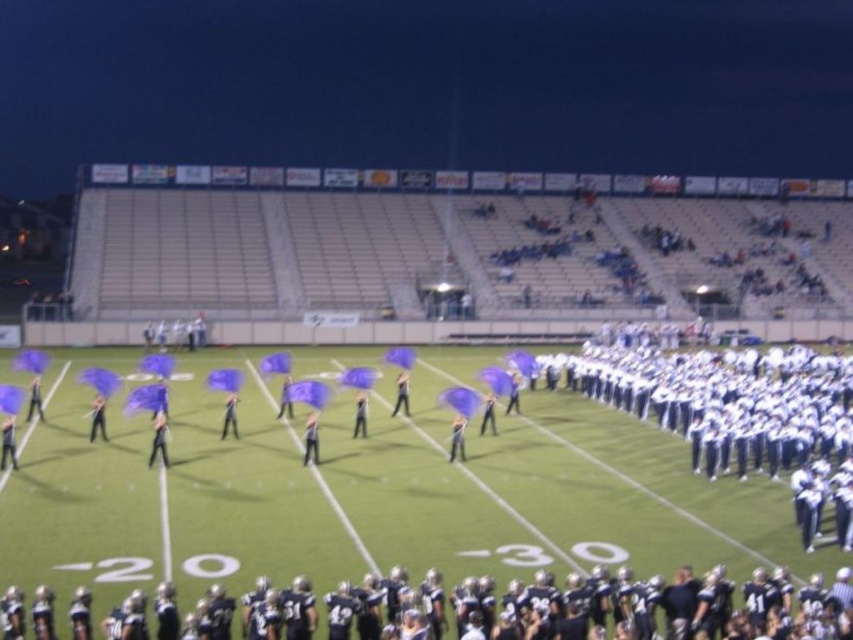
Question: Does black uniformed players at lower center appear on the left side of white uniformed football team at center?

Choices:
 (A) no
 (B) yes

Answer: (B)

Question: Does black uniformed players at lower center have a larger size compared to white uniformed football team at center?

Choices:
 (A) yes
 (B) no

Answer: (B)

Question: Which point appears farthest from the camera in this image?

Choices:
 (A) (798, 451)
 (B) (271, 624)

Answer: (A)

Question: Is the position of black uniformed players at lower center more distant than that of white uniformed football team at center?

Choices:
 (A) yes
 (B) no

Answer: (B)

Question: Which point is farther to the camera?

Choices:
 (A) white uniformed football team at center
 (B) black uniformed players at lower center

Answer: (A)

Question: Which of the following is the closest to the observer?

Choices:
 (A) black uniformed players at lower center
 (B) white uniformed football team at center

Answer: (A)